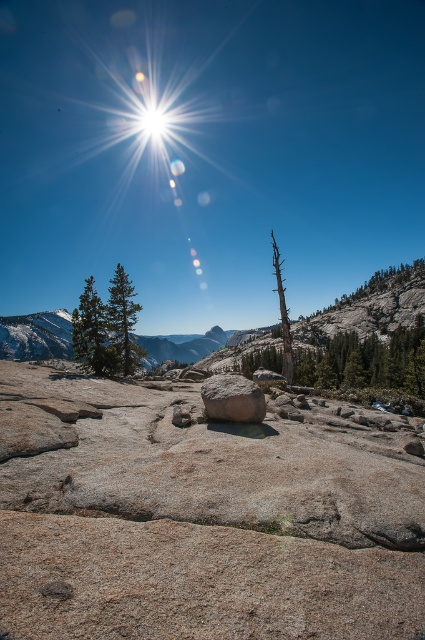
Question: Considering the relative positions of green matte tree at left and green matte tree at upper left in the image provided, where is green matte tree at left located with respect to green matte tree at upper left?

Choices:
 (A) below
 (B) above

Answer: (A)

Question: Is smooth gray tree at center to the left of dead wood at center from the viewer's perspective?

Choices:
 (A) no
 (B) yes

Answer: (A)

Question: Does smooth gray tree at center appear on the right side of dead wood at center?

Choices:
 (A) yes
 (B) no

Answer: (A)

Question: Which of these objects is positioned farthest from the dead wood at center?

Choices:
 (A) smooth gray tree at center
 (B) gray granite boulder at center
 (C) green matte tree at left
 (D) gray granite mountain at lower left

Answer: (D)

Question: Considering the real-world distances, which object is closest to the dead wood at center?

Choices:
 (A) gray granite boulder at center
 (B) green matte tree at left
 (C) gray granite mountain at lower left
 (D) smooth gray tree at center

Answer: (D)

Question: Estimate the real-world distances between objects in this image. Which object is closer to the gray granite boulder at center?

Choices:
 (A) gray granite mountain at lower left
 (B) green matte tree at upper left
 (C) green matte tree at left
 (D) dead wood at center

Answer: (C)